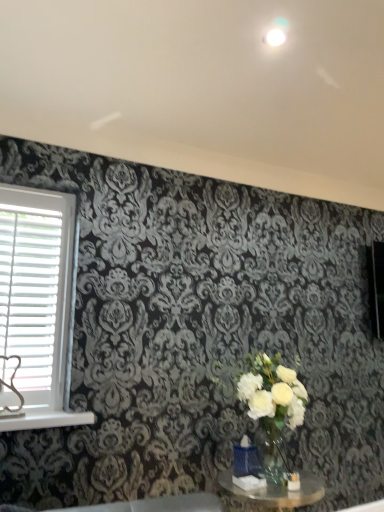
Question: Is white plastic blinds at left positioned in front of clear glass table at lower center?

Choices:
 (A) no
 (B) yes

Answer: (A)

Question: Is white plastic blinds at left positioned behind clear glass table at lower center?

Choices:
 (A) no
 (B) yes

Answer: (B)

Question: Is white plastic blinds at left oriented towards clear glass table at lower center?

Choices:
 (A) yes
 (B) no

Answer: (B)

Question: Is clear glass table at lower center at the back of white plastic blinds at left?

Choices:
 (A) yes
 (B) no

Answer: (B)

Question: Can you confirm if white plastic blinds at left is positioned to the right of clear glass table at lower center?

Choices:
 (A) yes
 (B) no

Answer: (B)

Question: Which is correct: white plastic blinds at left is inside clear glass table at lower center, or outside of it?

Choices:
 (A) outside
 (B) inside

Answer: (A)

Question: In the image, is white plastic blinds at left positioned in front of or behind clear glass table at lower center?

Choices:
 (A) front
 (B) behind

Answer: (B)

Question: Is white plastic blinds at left to the left or to the right of clear glass table at lower center in the image?

Choices:
 (A) left
 (B) right

Answer: (A)

Question: From the image's perspective, is white plastic blinds at left positioned above or below clear glass table at lower center?

Choices:
 (A) below
 (B) above

Answer: (B)

Question: In the image, is white plastic window sill at lower left on the left side or the right side of white plastic blinds at left?

Choices:
 (A) left
 (B) right

Answer: (B)

Question: From their relative heights in the image, would you say white plastic window sill at lower left is taller or shorter than white plastic blinds at left?

Choices:
 (A) tall
 (B) short

Answer: (B)

Question: Considering the positions of white plastic window sill at lower left and white plastic blinds at left in the image, is white plastic window sill at lower left bigger or smaller than white plastic blinds at left?

Choices:
 (A) big
 (B) small

Answer: (B)

Question: Choose the correct answer: Is white plastic window sill at lower left inside white plastic blinds at left or outside it?

Choices:
 (A) outside
 (B) inside

Answer: (A)

Question: Is clear glass table at lower center bigger or smaller than white plastic window sill at lower left?

Choices:
 (A) small
 (B) big

Answer: (B)

Question: From the image's perspective, is clear glass table at lower center above or below white plastic window sill at lower left?

Choices:
 (A) below
 (B) above

Answer: (A)